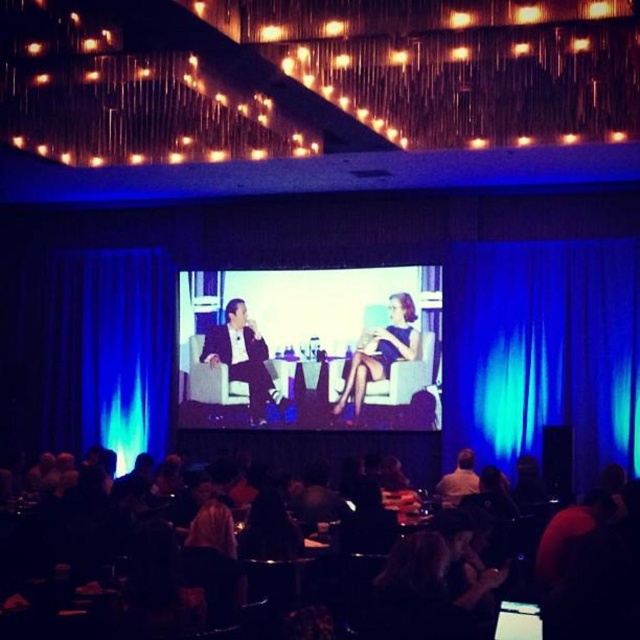
Does blue fabric curtain at right have a lesser height compared to blue fabric dress at center?

In fact, blue fabric curtain at right may be taller than blue fabric dress at center.

The width and height of the screenshot is (640, 640). What do you see at coordinates (544, 352) in the screenshot? I see `blue fabric curtain at right` at bounding box center [544, 352].

I want to click on blue fabric curtain at right, so pos(544,352).

Where is `blue fabric curtain at right`? The width and height of the screenshot is (640, 640). blue fabric curtain at right is located at coordinates (544, 352).

In order to click on blue velvet curtain at left in this screenshot , I will do `click(108, 353)`.

Can you confirm if blue velvet curtain at left is wider than blue fabric dress at center?

Yes, blue velvet curtain at left is wider than blue fabric dress at center.

Which is behind, point (124, 403) or point (356, 355)?

The point (124, 403) is behind.

I want to click on blue velvet curtain at left, so click(108, 353).

Consider the image. Which of these two, blue fabric dress at center or light brown leather jacket at center, stands shorter?

With less height is light brown leather jacket at center.

Is blue fabric dress at center wider than light brown leather jacket at center?

Yes.

Measure the distance between blue fabric dress at center and camera.

blue fabric dress at center is 10.22 meters from camera.

I want to click on blue fabric dress at center, so click(381, 352).